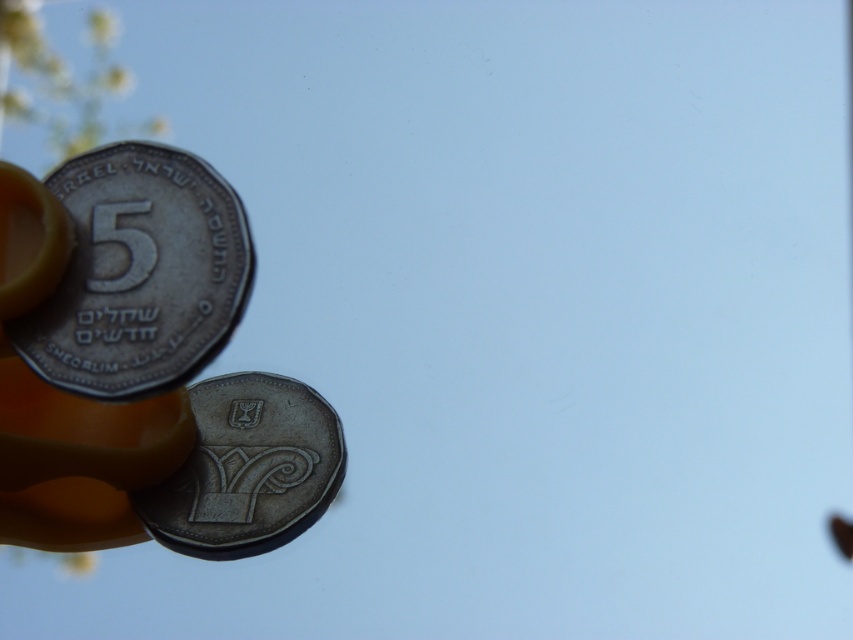
Does silver metallic coin at upper left come behind shiny silver coin at center?

That is False.

Is silver metallic coin at upper left thinner than shiny silver coin at center?

Yes.

The height and width of the screenshot is (640, 853). In order to click on silver metallic coin at upper left in this screenshot , I will do `click(138, 273)`.